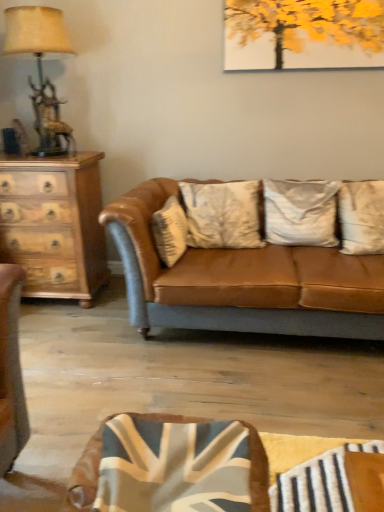
Where is `vacant area that is in front of wooden chest of drawers at left`? vacant area that is in front of wooden chest of drawers at left is located at coordinates (60, 329).